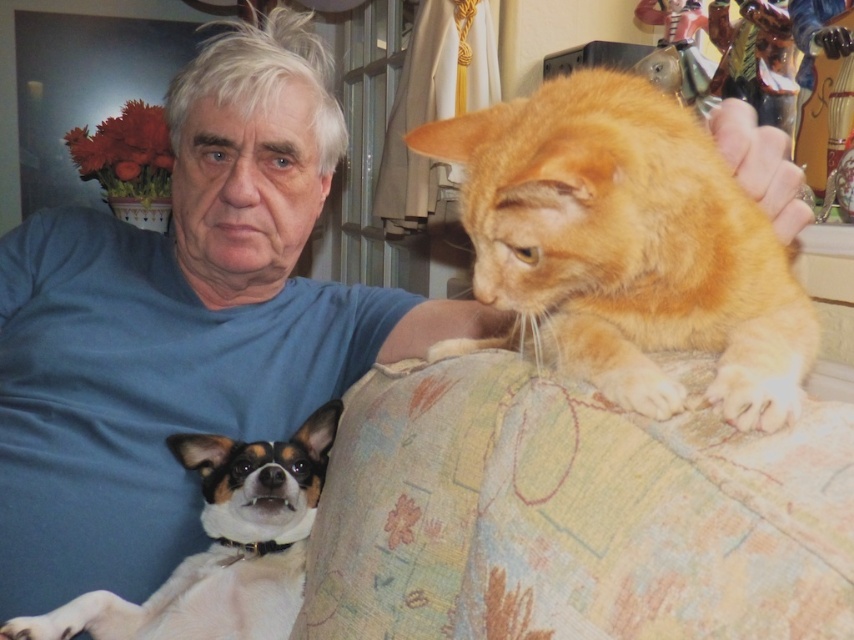
Who is more distant from viewer, (595, 200) or (145, 604)?

Positioned behind is point (145, 604).

Is orange fur cat at upper right taller than white fur dog at lower left?

Indeed, orange fur cat at upper right has a greater height compared to white fur dog at lower left.

Identify the location of orange fur cat at upper right. (629, 244).

Where is `orange fur cat at upper right`? The height and width of the screenshot is (640, 854). orange fur cat at upper right is located at coordinates (629, 244).

In the scene shown: Is blue cotton shirt at upper left smaller than white fur dog at lower left?

No, blue cotton shirt at upper left is not smaller than white fur dog at lower left.

Who is higher up, blue cotton shirt at upper left or white fur dog at lower left?

blue cotton shirt at upper left is higher up.

Who is more distant from viewer, (63,564) or (148,611)?

The point (63,564) is behind.

At what (x,y) coordinates should I click in order to perform the action: click on blue cotton shirt at upper left. Please return your answer as a coordinate pair (x, y). Looking at the image, I should click on point(182,324).

Does blue cotton shirt at upper left have a smaller size compared to orange fur cat at upper right?

Incorrect, blue cotton shirt at upper left is not smaller in size than orange fur cat at upper right.

Which is behind, point (249, 392) or point (714, 394)?

The point (249, 392) is more distant.

Is point (18, 593) behind point (496, 176)?

Yes, it is behind point (496, 176).

Locate an element on the screen. blue cotton shirt at upper left is located at coordinates (182, 324).